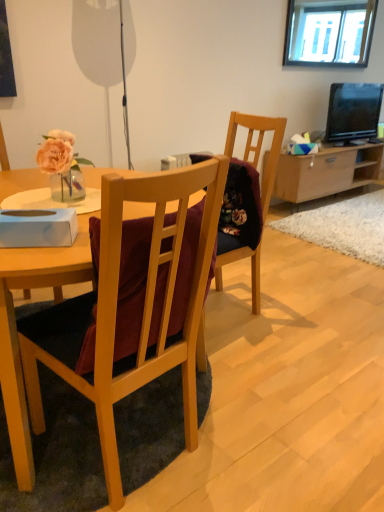
In order to face wooden chair at center, should I rotate leftwards or rightwards?

A 3.119 degree turn to the right will do.

Measure the distance between point (255, 255) and camera.

Point (255, 255) and camera are 2.12 meters apart.

What do you see at coordinates (353, 111) in the screenshot? I see `matte black television at upper right` at bounding box center [353, 111].

Locate an element on the screen. wooden chair at center is located at coordinates (116, 310).

Considering the points (299, 23) and (354, 150), which point is behind, point (299, 23) or point (354, 150)?

Positioned behind is point (299, 23).

From the image's perspective, which one is positioned higher, clear glass window at upper center or light brown wood cabinet at center right?

clear glass window at upper center appears higher in the image.

How different are the orientations of clear glass window at upper center and light brown wood cabinet at center right in degrees?

There is a 0.681-degree angle between the facing directions of clear glass window at upper center and light brown wood cabinet at center right.

Based on the photo, is wooden chair at center positioned with its back to light brown wood cabinet at center right?

That's not correct — wooden chair at center is not looking away from light brown wood cabinet at center right.

From the image's perspective, which one is positioned lower, wooden chair at center or light brown wood cabinet at center right?

From the image's view, wooden chair at center is below.

Would you say wooden chair at center is inside or outside light brown wood cabinet at center right?

wooden chair at center is located beyond the bounds of light brown wood cabinet at center right.

This screenshot has height=512, width=384. Find the location of `chair to the left of wooden chair at center`. chair to the left of wooden chair at center is located at coordinates (116, 310).

Could wooden chair at center be considered to be inside wooden chair at center?

No, wooden chair at center is not a part of wooden chair at center.

From the image's perspective, between wooden chair at center and wooden chair at center, which one is located above?

wooden chair at center, from the image's perspective.

Find the location of a particular element. The image size is (384, 512). cabinetry below the wooden chair at center (from a real-world perspective) is located at coordinates [x=326, y=172].

Is light brown wood cabinet at center right next to wooden chair at center?

light brown wood cabinet at center right is not next to wooden chair at center, and they're not touching.

Which is behind, point (379, 156) or point (262, 135)?

The point (379, 156) is farther.

Does light brown wood cabinet at center right lie behind wooden chair at center?

Yes, light brown wood cabinet at center right is behind wooden chair at center.

Between light brown wood cabinet at center right and clear glass window at upper center, which one has larger width?

light brown wood cabinet at center right is wider.

Locate an element on the screen. This screenshot has height=512, width=384. cabinetry below the clear glass window at upper center (from the image's perspective) is located at coordinates (x=326, y=172).

Is light brown wood cabinet at center right to the right of clear glass window at upper center from the viewer's perspective?

Yes, light brown wood cabinet at center right is to the right of clear glass window at upper center.

Is light brown wood cabinet at center right next to clear glass window at upper center and touching it?

light brown wood cabinet at center right and clear glass window at upper center are clearly separated.

Is wooden chair at center aimed at wooden chair at center?

No, wooden chair at center is not turned towards wooden chair at center.

From the picture: Does wooden chair at center lie behind wooden chair at center?

No, the depth of wooden chair at center is less than that of wooden chair at center.

Which is closer, (102, 194) or (266, 123)?

The point (102, 194) is closer.

Consider the image. How different are the orientations of matte black television at upper right and wooden chair at center in degrees?

177 degrees separate the facing orientations of matte black television at upper right and wooden chair at center.

Is point (329, 141) closer or farther from the camera than point (117, 205)?

Point (329, 141) appears to be farther away from the viewer than point (117, 205).

Identify the location of chair on the left of matte black television at upper right. (116, 310).

From the image's perspective, which one is positioned higher, matte black television at upper right or wooden chair at center?

matte black television at upper right appears higher in the image.

The height and width of the screenshot is (512, 384). I want to click on window on the left of light brown wood cabinet at center right, so click(x=329, y=33).

Image resolution: width=384 pixels, height=512 pixels. What are the coordinates of `cabinetry below the wooden chair at center (from a real-world perspective)` in the screenshot? It's located at (326, 172).

When comparing their distances from light brown wood cabinet at center right, does wooden chair at center or clear glass window at upper center seem further?

Based on the image, wooden chair at center appears to be further to light brown wood cabinet at center right.

Based on their spatial positions, is light brown wood cabinet at center right or wooden chair at center further from matte black television at upper right?

wooden chair at center.

Based on their spatial positions, is wooden chair at center or clear glass window at upper center further from wooden chair at center?

clear glass window at upper center lies further to wooden chair at center than the other object.

From the image, which object appears to be farther from wooden chair at center, light brown wood cabinet at center right or matte black television at upper right?

The object further to wooden chair at center is matte black television at upper right.

Which object lies nearer to the anchor point light brown wood cabinet at center right, clear glass window at upper center or matte black television at upper right?

matte black television at upper right lies closer to light brown wood cabinet at center right than the other object.

Based on their spatial positions, is clear glass window at upper center or wooden chair at center further from light brown wood cabinet at center right?

Based on the image, wooden chair at center appears to be further to light brown wood cabinet at center right.

Looking at this image, which object lies nearer to the anchor point clear glass window at upper center, wooden chair at center or matte black television at upper right?

matte black television at upper right lies closer to clear glass window at upper center than the other object.

Considering their positions, is wooden chair at center positioned closer to wooden chair at center than light brown wood cabinet at center right?

Based on the image, wooden chair at center appears to be nearer to wooden chair at center.

Find the location of a particular element. The width and height of the screenshot is (384, 512). window located between wooden chair at center and light brown wood cabinet at center right in the depth direction is located at coordinates (329, 33).

The image size is (384, 512). I want to click on television between clear glass window at upper center and light brown wood cabinet at center right in the up-down direction, so click(x=353, y=111).

What are the coordinates of `window located between wooden chair at center and matte black television at upper right in the depth direction` in the screenshot? It's located at (329, 33).

I want to click on armchair located between wooden chair at center and clear glass window at upper center in the depth direction, so click(261, 192).